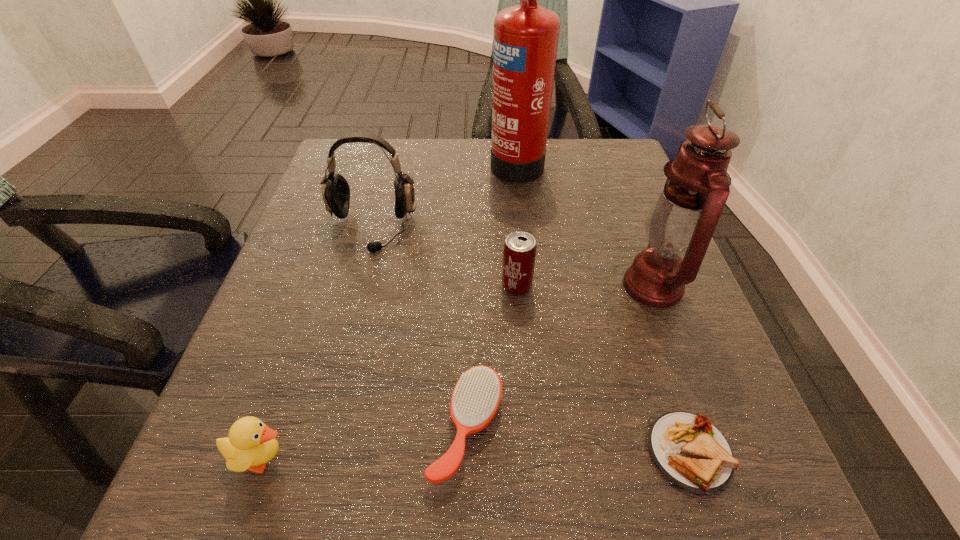
In order to click on fire extinguisher in this screenshot , I will do `click(525, 41)`.

At what (x,y) coordinates should I click in order to perform the action: click on the tallest object. Please return your answer as a coordinate pair (x, y). This screenshot has width=960, height=540. Looking at the image, I should click on (525, 41).

Locate an element on the screen. This screenshot has height=540, width=960. oil lamp is located at coordinates (681, 222).

Locate an element on the screen. This screenshot has width=960, height=540. the second farthest object is located at coordinates (335, 189).

Image resolution: width=960 pixels, height=540 pixels. I want to click on the third tallest object, so click(335, 189).

Locate an element on the screen. beer can is located at coordinates (519, 253).

Locate an element on the screen. This screenshot has width=960, height=540. duckling is located at coordinates (251, 444).

Identify the location of the sixth tallest object. This screenshot has width=960, height=540. (476, 397).

Find the location of `sandwich`. sandwich is located at coordinates (690, 451).

Find the location of a particular element. Image resolution: width=960 pixels, height=540 pixels. vacant space positioned on the surface of the farthest object is located at coordinates (466, 161).